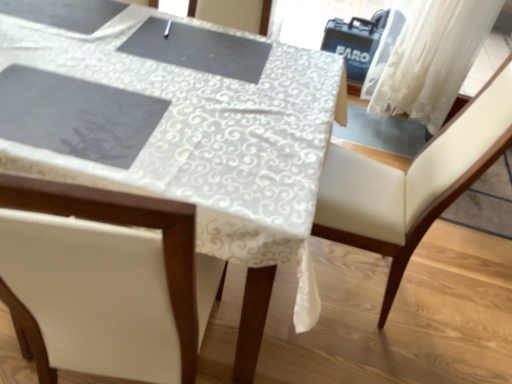
What do you see at coordinates (413, 182) in the screenshot?
I see `white leather chair at center` at bounding box center [413, 182].

The width and height of the screenshot is (512, 384). I want to click on white lace tablecloth at center, so click(x=191, y=144).

The width and height of the screenshot is (512, 384). In the image, there is a white leather chair at center. What are the coordinates of `table below it (from a real-world perspective)` in the screenshot? It's located at (191, 144).

From a real-world perspective, between white lace tablecloth at center and white leather chair at center, who is vertically higher?

white leather chair at center, from a real-world perspective.

Which is more to the right, white lace tablecloth at center or white leather chair at center?

From the viewer's perspective, white leather chair at center appears more on the right side.

How different are the orientations of white lace tablecloth at center and white leather chair at center in degrees?

white lace tablecloth at center and white leather chair at center are facing 92.1 degrees away from each other.

How different are the orientations of white sheer curtain at upper right and white lace tablecloth at center in degrees?

The angular difference between white sheer curtain at upper right and white lace tablecloth at center is 0.0674 degrees.

Which object is closer to the camera taking this photo, white sheer curtain at upper right or white lace tablecloth at center?

Positioned in front is white lace tablecloth at center.

Considering the sizes of objects white sheer curtain at upper right and white lace tablecloth at center in the image provided, who is bigger, white sheer curtain at upper right or white lace tablecloth at center?

white lace tablecloth at center.

Considering the positions of point (399, 51) and point (42, 347), is point (399, 51) closer or farther from the camera than point (42, 347)?

Point (399, 51) appears to be farther away from the viewer than point (42, 347).

From a real-world perspective, which object rests below the other?

white sheer curtain at upper right is physically lower.

At what (x,y) coordinates should I click in order to perform the action: click on curtain located underneath the white leather chair at center (from a real-world perspective). Please return your answer as a coordinate pair (x, y). Image resolution: width=512 pixels, height=384 pixels. Looking at the image, I should click on coord(432,58).

Considering the points (454, 69) and (325, 222), which point is behind, point (454, 69) or point (325, 222)?

Positioned behind is point (454, 69).

Does white sheer curtain at upper right have a larger size compared to white leather chair at center?

Incorrect, white sheer curtain at upper right is not larger than white leather chair at center.

How many degrees apart are the facing directions of white leather chair at center and white sheer curtain at upper right?

They differ by 92.2 degrees in their facing directions.

Is white leather chair at center shorter than white sheer curtain at upper right?

No, white leather chair at center is not shorter than white sheer curtain at upper right.

Is white leather chair at center looking in the opposite direction of white sheer curtain at upper right?

No, white leather chair at center is not facing the opposite direction of white sheer curtain at upper right.

Is white leather chair at center at the right side of white sheer curtain at upper right?

No.

Which is farther, (x=426, y=170) or (x=5, y=292)?

Point (x=426, y=170)

Identify the location of table located on the left of white leather chair at center. Image resolution: width=512 pixels, height=384 pixels. (191, 144).

Does white leather chair at center have a greater width compared to white lace tablecloth at center?

No, white leather chair at center is not wider than white lace tablecloth at center.

Is white leather chair at center next to white lace tablecloth at center and touching it?

white leather chair at center and white lace tablecloth at center are clearly separated.

Which is behind, white lace tablecloth at center or white sheer curtain at upper right?

white sheer curtain at upper right.

From the image's perspective, does white lace tablecloth at center appear higher than white sheer curtain at upper right?

Incorrect, from the image's perspective, white lace tablecloth at center is lower than white sheer curtain at upper right.

Based on the photo, is white lace tablecloth at center turned away from white sheer curtain at upper right?

Yes, white lace tablecloth at center is facing away from white sheer curtain at upper right.

Identify the location of table that appears below the white sheer curtain at upper right (from the image's perspective). (191, 144).

Identify the location of chair behind the white lace tablecloth at center. Image resolution: width=512 pixels, height=384 pixels. (413, 182).

Where is `table that is on the left side of white sheer curtain at upper right`? table that is on the left side of white sheer curtain at upper right is located at coordinates (191, 144).

Based on their spatial positions, is white sheer curtain at upper right or white lace tablecloth at center closer to white leather chair at center?

The object closer to white leather chair at center is white lace tablecloth at center.

Estimate the real-world distances between objects in this image. Which object is closer to white sheer curtain at upper right, white lace tablecloth at center or white leather chair at center?

white leather chair at center lies closer to white sheer curtain at upper right than the other object.

Considering their positions, is white leather chair at center positioned further to white lace tablecloth at center than white sheer curtain at upper right?

white sheer curtain at upper right is further to white lace tablecloth at center.

Looking at the image, which one is located further to white sheer curtain at upper right, white leather chair at center or white lace tablecloth at center?

white lace tablecloth at center lies further to white sheer curtain at upper right than the other object.

Which object lies nearer to the anchor point white lace tablecloth at center, white sheer curtain at upper right or white leather chair at center?

Based on the image, white leather chair at center appears to be nearer to white lace tablecloth at center.

Based on their spatial positions, is white lace tablecloth at center or white sheer curtain at upper right closer to white leather chair at center?

The object closer to white leather chair at center is white lace tablecloth at center.

Locate an element on the screen. chair located between white lace tablecloth at center and white sheer curtain at upper right in the left-right direction is located at coordinates (413, 182).